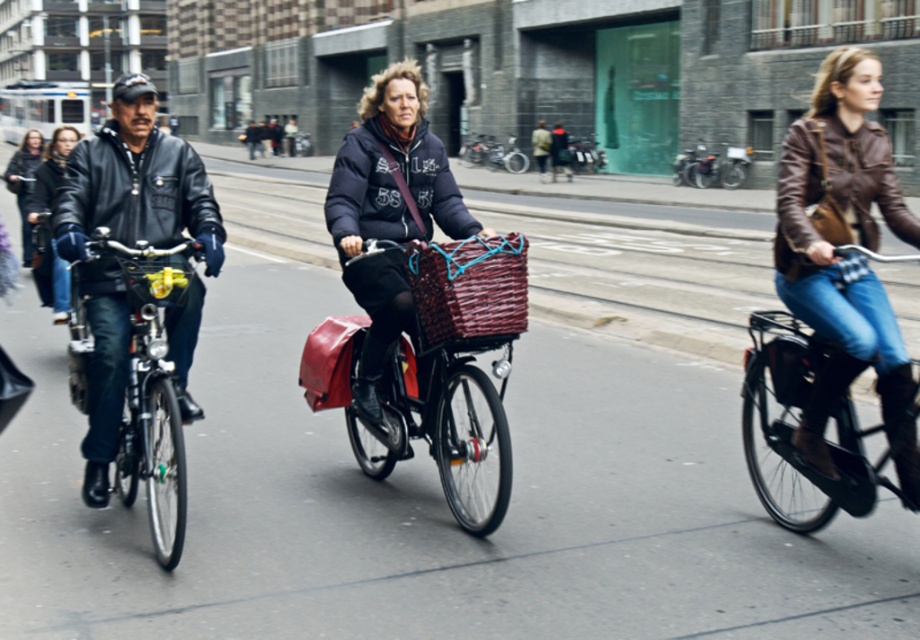
Question: Which point is farther from the camera taking this photo?

Choices:
 (A) (723, 186)
 (B) (59, 289)
 (C) (454, 243)

Answer: (A)

Question: Which object is positioned closest to the matte black jacket at center?

Choices:
 (A) metallic silver bicycle at center
 (B) brown leather jacket at right
 (C) woven brown basket at center

Answer: (C)

Question: Is matte black jacket at center to the left of matte black jacket at upper left from the viewer's perspective?

Choices:
 (A) no
 (B) yes

Answer: (A)

Question: Which point appears farthest from the camera in this image?

Choices:
 (A) (96, 346)
 (B) (48, 276)
 (C) (598, 160)

Answer: (C)

Question: Is woven brown basket at center positioned before matte black jacket at left?

Choices:
 (A) no
 (B) yes

Answer: (B)

Question: From the image, what is the correct spatial relationship of black leather bicycle at right in relation to shiny black bicycle at center?

Choices:
 (A) below
 (B) above

Answer: (A)